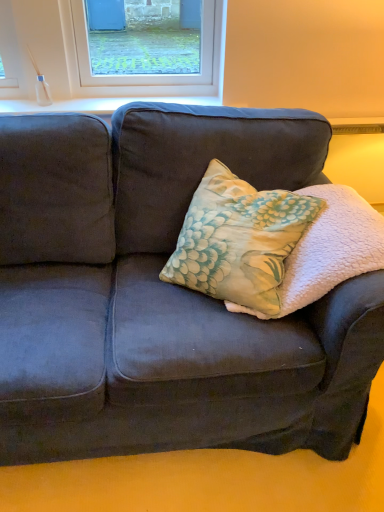
Question: From the image's perspective, is velvet dark blue couch at center located above or below floral fabric pillow at center?

Choices:
 (A) below
 (B) above

Answer: (A)

Question: Is velvet dark blue couch at center situated inside floral fabric pillow at center or outside?

Choices:
 (A) outside
 (B) inside

Answer: (A)

Question: Considering the real-world distances, which object is closest to the white smooth window sill at upper center?

Choices:
 (A) floral fabric pillow at center
 (B) velvet dark blue couch at center
 (C) floral fabric pillow at center

Answer: (C)

Question: Which is farther from the white smooth window sill at upper center?

Choices:
 (A) floral fabric pillow at center
 (B) floral fabric pillow at center
 (C) velvet dark blue couch at center

Answer: (A)